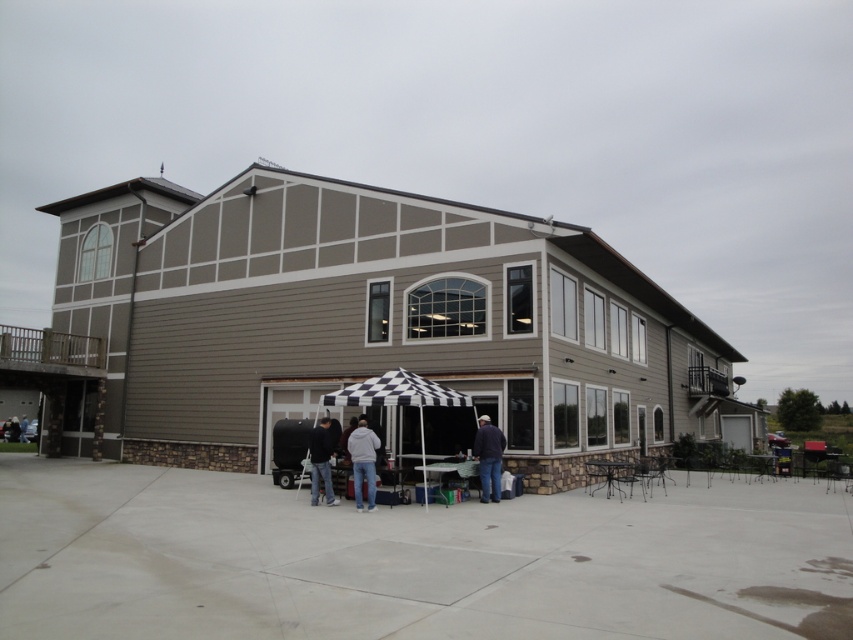
You are planning to set up a new table for an event. The table is 2 meters wide. You want to place it under the black fabric umbrella at center so that it doesn not block the view of the black fabric person at lower left. Is the space under the umbrella wide enough to accommodate the table without blocking the person?

The black fabric umbrella at center might be wider than the black fabric person at lower left, so there is a possibility that the space under the umbrella is wide enough to place the 2m table without blocking the person. However, since the exact width difference isn not specified, it is recommended to measure the actual space before placing the table.